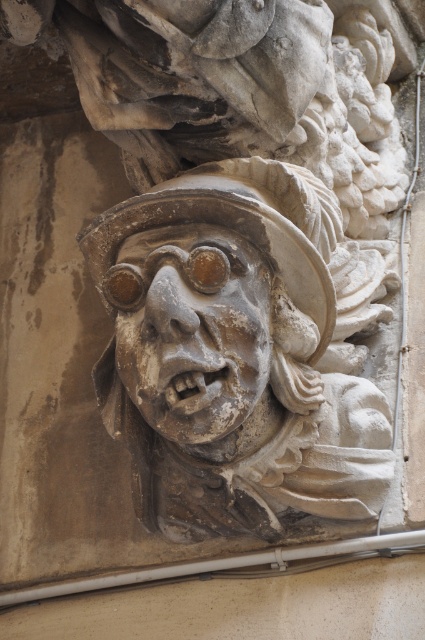
Question: Can you confirm if stone carved face at center is smaller than gray stone face at center?

Choices:
 (A) no
 (B) yes

Answer: (A)

Question: Among these objects, which one is farthest from the camera?

Choices:
 (A) stone carved face at center
 (B) gray stone face at center

Answer: (A)

Question: Which object is closer to the camera taking this photo?

Choices:
 (A) gray stone face at center
 (B) stone carved face at center

Answer: (A)

Question: Can you confirm if stone carved face at center is positioned to the right of gray stone face at center?

Choices:
 (A) yes
 (B) no

Answer: (A)

Question: Can you confirm if stone carved face at center is wider than gray stone face at center?

Choices:
 (A) yes
 (B) no

Answer: (A)

Question: Which object appears farthest from the camera in this image?

Choices:
 (A) gray stone face at center
 (B) stone carved face at center

Answer: (B)